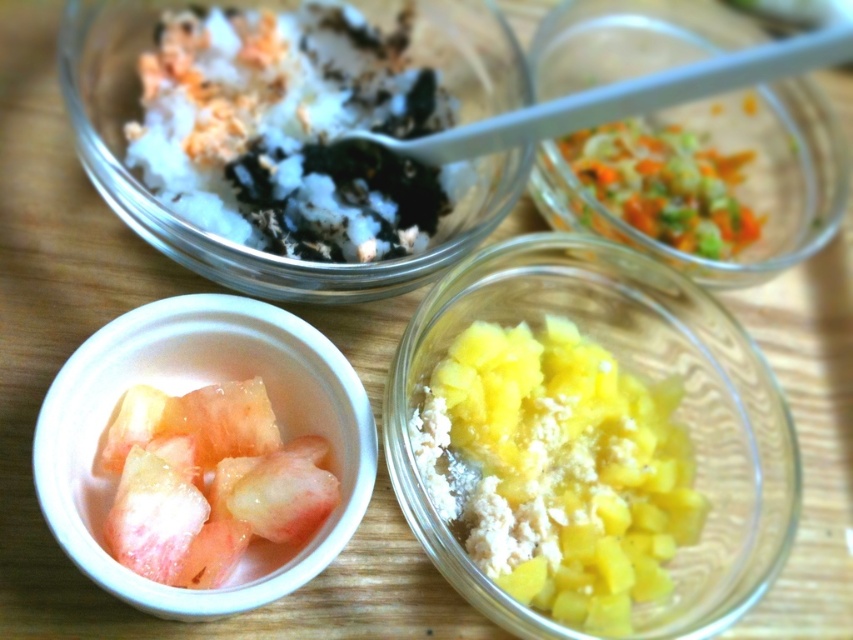
From the picture: You are arranging a fruit platter and need to place the yellow matte pineapple chunks at center and the translucent glass bowl at upper right on a tray. Based on their positions in the image, which object should you place first to maintain the same arrangement?

The yellow matte pineapple chunks at center should be placed first since it is positioned on the left side of the translucent glass bowl at upper right, so placing it first allows the bowl to be placed to its right.

You are standing 3 feet away from the wooden surface where the bowls are placed. Can you reach the point at coordinates point (550,212) without moving your position?

The point at coordinates point (550,212) is 3.45 feet away from the viewer. Since you are standing 3 feet away from the wooden surface, you are 0.45 feet too far to reach the point without moving closer.

You are holding a camera and want to take a closeup shot of the translucent glass bowl at upper right. Based on the scene description, is the bowl within the camera focus range of 1 meter? Please explain your answer.

The translucent glass bowl at upper right is 95.52 centimeters away from the camera, which is less than 1 meter. Therefore, it is within the camera focus range of 1 meter and can be captured clearly.